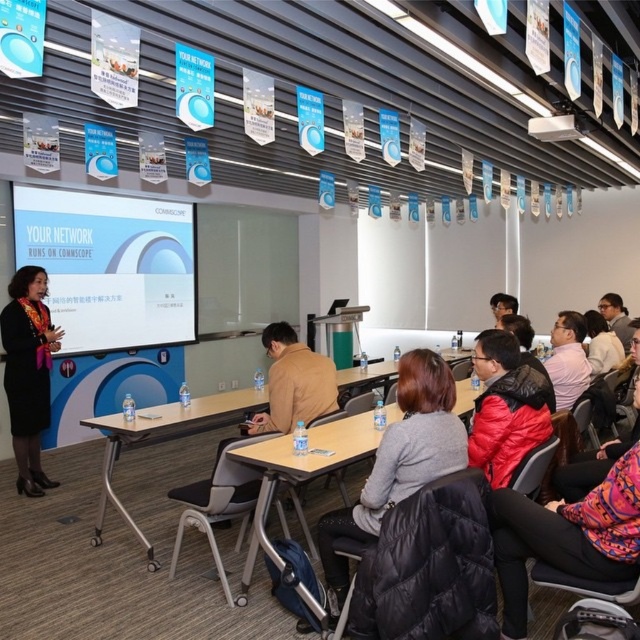
Based on the photo, between patterned fabric jacket at lower right and black fabric dress at lower left, which one is positioned higher?

black fabric dress at lower left

This screenshot has width=640, height=640. Describe the element at coordinates (566, 536) in the screenshot. I see `patterned fabric jacket at lower right` at that location.

Identify the location of patterned fabric jacket at lower right. The width and height of the screenshot is (640, 640). (566, 536).

In the scene shown: Can you confirm if black fabric dress at lower left is thinner than light brown wooden table at center?

Yes, black fabric dress at lower left is thinner than light brown wooden table at center.

From the picture: Who is shorter, black fabric dress at lower left or light brown wooden table at center?

Standing shorter between the two is light brown wooden table at center.

Locate an element on the screen. Image resolution: width=640 pixels, height=640 pixels. black fabric dress at lower left is located at coordinates point(28,372).

Between white glossy projection screen at center and wooden table at center, which one has more height?

Standing taller between the two is white glossy projection screen at center.

Who is lower down, white glossy projection screen at center or wooden table at center?

wooden table at center is below.

Locate an element on the screen. Image resolution: width=640 pixels, height=640 pixels. white glossy projection screen at center is located at coordinates (109, 266).

Identify the location of white glossy projection screen at center. (109, 266).